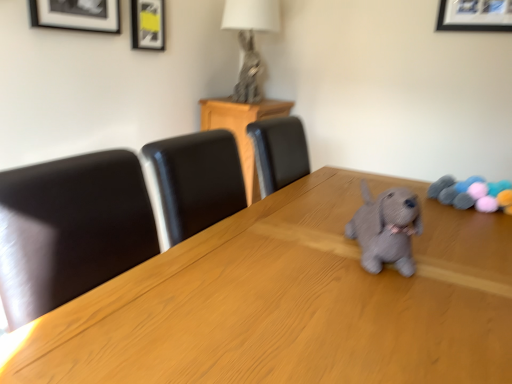
Question: Would you say gray knitted stuffed animal at right is a long distance from metallic silver rabbit at upper center?

Choices:
 (A) yes
 (B) no

Answer: (A)

Question: Is gray knitted stuffed animal at right bigger than metallic silver rabbit at upper center?

Choices:
 (A) yes
 (B) no

Answer: (B)

Question: Is gray knitted stuffed animal at right next to metallic silver rabbit at upper center?

Choices:
 (A) no
 (B) yes

Answer: (A)

Question: From the image's perspective, is gray knitted stuffed animal at right under metallic silver rabbit at upper center?

Choices:
 (A) no
 (B) yes

Answer: (B)

Question: Is the position of gray knitted stuffed animal at right less distant than that of metallic silver rabbit at upper center?

Choices:
 (A) yes
 (B) no

Answer: (A)

Question: From the image's perspective, is matte black picture frame at upper left, which is counted as the 1th picture frame, starting from the right, positioned above or below gray knitted dog at center?

Choices:
 (A) below
 (B) above

Answer: (B)

Question: From a real-world perspective, is matte black picture frame at upper left, acting as the 1th picture frame starting from the back, above or below gray knitted dog at center?

Choices:
 (A) below
 (B) above

Answer: (B)

Question: Considering the positions of matte black picture frame at upper left, acting as the second picture frame starting from the front, and gray knitted dog at center in the image, is matte black picture frame at upper left, acting as the second picture frame starting from the front, bigger or smaller than gray knitted dog at center?

Choices:
 (A) big
 (B) small

Answer: (B)

Question: In the image, is matte black picture frame at upper left, arranged as the second picture frame when viewed from the left, positioned in front of or behind gray knitted dog at center?

Choices:
 (A) front
 (B) behind

Answer: (B)

Question: Is point (373, 225) positioned closer to the camera than point (490, 190)?

Choices:
 (A) closer
 (B) farther

Answer: (A)

Question: Considering their positions, is gray knitted dog at center located in front of or behind gray knitted stuffed animal at right?

Choices:
 (A) front
 (B) behind

Answer: (A)

Question: Is gray knitted dog at center taller or shorter than gray knitted stuffed animal at right?

Choices:
 (A) tall
 (B) short

Answer: (A)

Question: From a real-world perspective, is gray knitted dog at center positioned above or below gray knitted stuffed animal at right?

Choices:
 (A) above
 (B) below

Answer: (A)

Question: Is gray knitted dog at center spatially inside matte black picture frame at upper left, the 2th picture frame viewed from the back, or outside of it?

Choices:
 (A) outside
 (B) inside

Answer: (A)

Question: Is gray knitted dog at center wider or thinner than matte black picture frame at upper left, which ranks as the first picture frame in left-to-right order?

Choices:
 (A) thin
 (B) wide

Answer: (B)